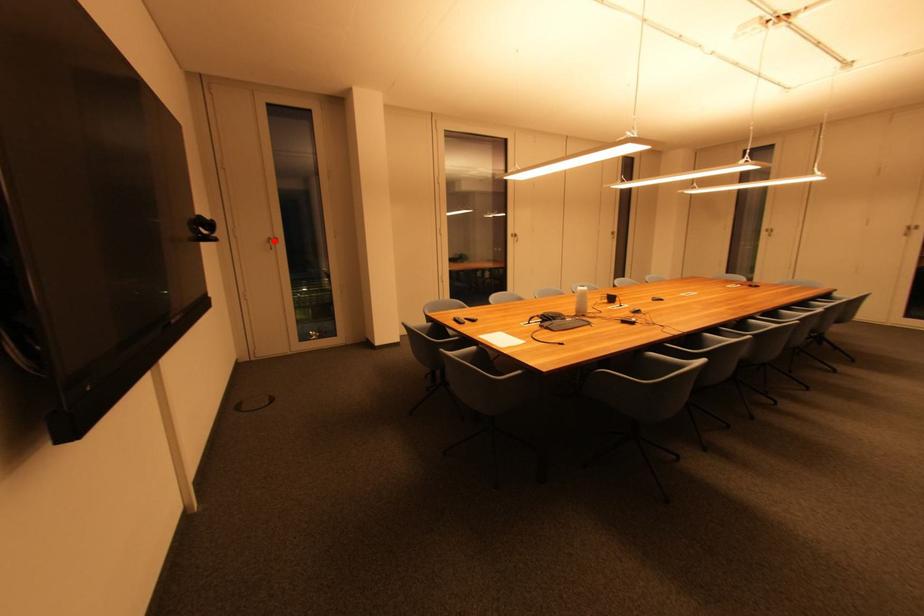
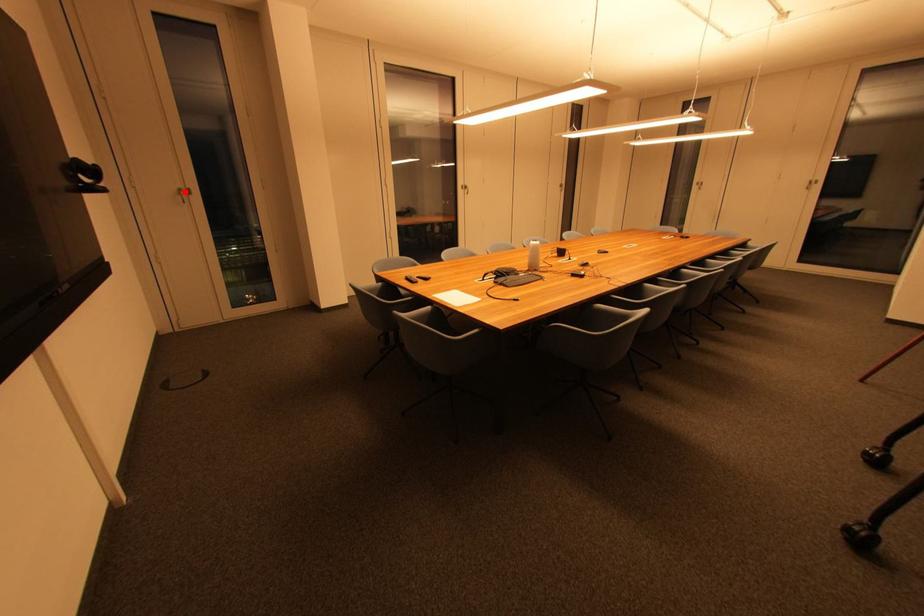
I am providing you with two images of the same scene from different viewpoints. A red point is marked on the first image and another point is marked on the second image. Do the highlighted points in image1 and image2 indicate the same real-world spot?

Yes